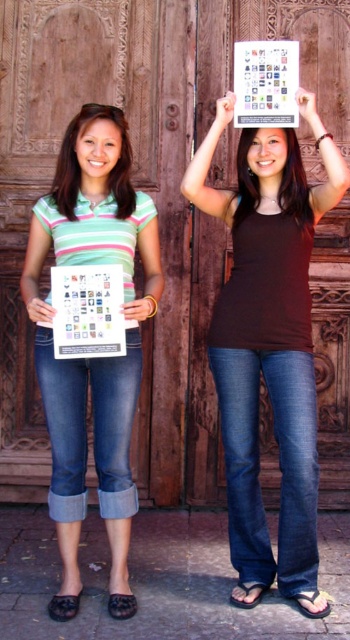
At what (x,y) coordinates should I click in order to perform the action: click on matte green striped shirt at center. Please return your answer as a coordinate pair (x, y). This screenshot has width=350, height=640. Looking at the image, I should click on (93, 358).

Who is positioned more to the left, matte green striped shirt at center or matte green striped shirt at left?

Positioned to the left is matte green striped shirt at left.

Does point (44, 410) lie behind point (131, 200)?

That is False.

At what (x,y) coordinates should I click in order to perform the action: click on matte green striped shirt at center. Please return your answer as a coordinate pair (x, y). Looking at the image, I should click on (93, 358).

Between matte green striped shirt at center and matte brown shirt at upper center, which one has more height?

Standing taller between the two is matte green striped shirt at center.

The width and height of the screenshot is (350, 640). What are the coordinates of `matte green striped shirt at center` in the screenshot? It's located at (93, 358).

Which of these two, brown matte tank top at upper center or matte green striped shirt at center, stands taller?

With more height is brown matte tank top at upper center.

Is point (277, 396) less distant than point (59, 387)?

No, it is behind (59, 387).

Which is behind, point (292, 150) or point (101, 140)?

The point (292, 150) is behind.

This screenshot has height=640, width=350. What are the coordinates of `brown matte tank top at upper center` in the screenshot? It's located at 269,348.